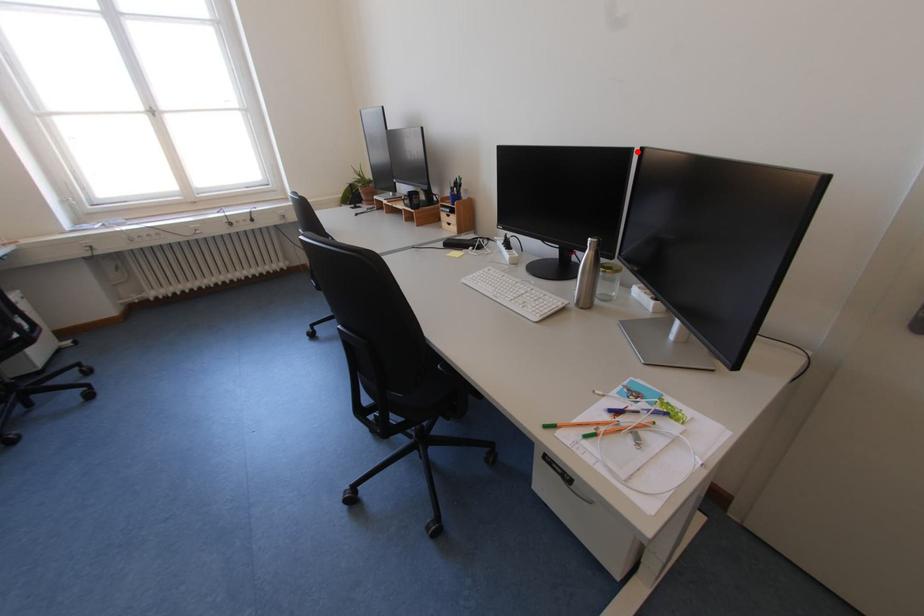
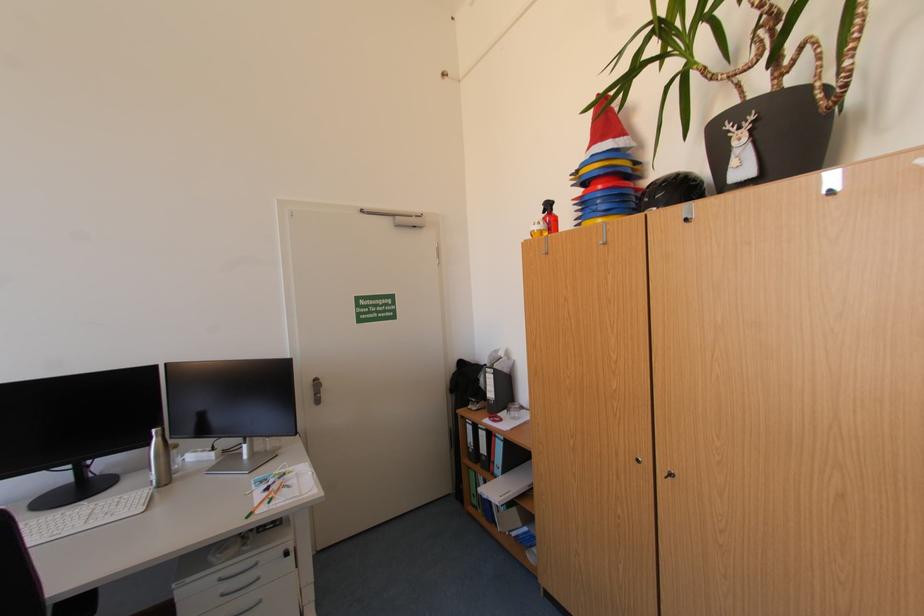
Where in the second image is the point corresponding to the highlighted location from the first image?

(164, 368)